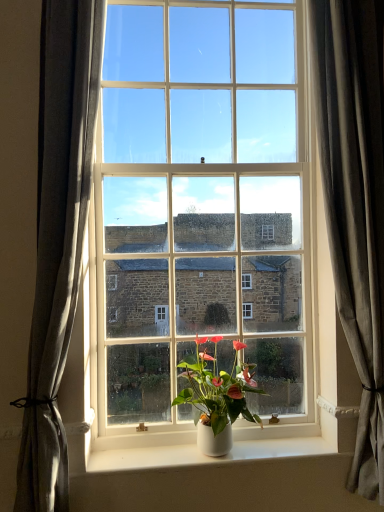
Question: Is there a large distance between gray fabric curtain at right, which appears as the 1th curtain when viewed from the right, and white glossy pot at center?

Choices:
 (A) no
 (B) yes

Answer: (A)

Question: Is gray fabric curtain at right, which appears as the 1th curtain when viewed from the right, next to white glossy pot at center?

Choices:
 (A) no
 (B) yes

Answer: (A)

Question: From a real-world perspective, is gray fabric curtain at right, marked as the second curtain in a left-to-right arrangement, under white glossy pot at center?

Choices:
 (A) no
 (B) yes

Answer: (A)

Question: From a real-world perspective, is gray fabric curtain at right, which appears as the 1th curtain when viewed from the right, on white glossy pot at center?

Choices:
 (A) no
 (B) yes

Answer: (B)

Question: Is gray fabric curtain at right, marked as the second curtain in a left-to-right arrangement, oriented away from white glossy pot at center?

Choices:
 (A) yes
 (B) no

Answer: (B)

Question: Is the depth of gray fabric curtain at right, marked as the second curtain in a left-to-right arrangement, greater than that of white glossy pot at center?

Choices:
 (A) no
 (B) yes

Answer: (A)

Question: From the image's perspective, is gray fabric curtain at right, marked as the second curtain in a left-to-right arrangement, below white glossy window at center?

Choices:
 (A) yes
 (B) no

Answer: (A)

Question: Can you confirm if gray fabric curtain at right, which appears as the 1th curtain when viewed from the right, is shorter than white glossy window at center?

Choices:
 (A) no
 (B) yes

Answer: (B)

Question: Is gray fabric curtain at right, which appears as the 1th curtain when viewed from the right, further to camera compared to white glossy window at center?

Choices:
 (A) yes
 (B) no

Answer: (B)

Question: Considering the relative sizes of gray fabric curtain at right, which appears as the 1th curtain when viewed from the right, and white glossy window at center in the image provided, is gray fabric curtain at right, which appears as the 1th curtain when viewed from the right, taller than white glossy window at center?

Choices:
 (A) no
 (B) yes

Answer: (A)

Question: Would you say gray fabric curtain at right, marked as the second curtain in a left-to-right arrangement, is outside white glossy window at center?

Choices:
 (A) no
 (B) yes

Answer: (B)

Question: Does gray fabric curtain at right, marked as the second curtain in a left-to-right arrangement, have a lesser width compared to white glossy window at center?

Choices:
 (A) yes
 (B) no

Answer: (A)

Question: Is gray fabric curtain at left, the second curtain in the right-to-left sequence, facing away from white matte window sill at center?

Choices:
 (A) no
 (B) yes

Answer: (A)